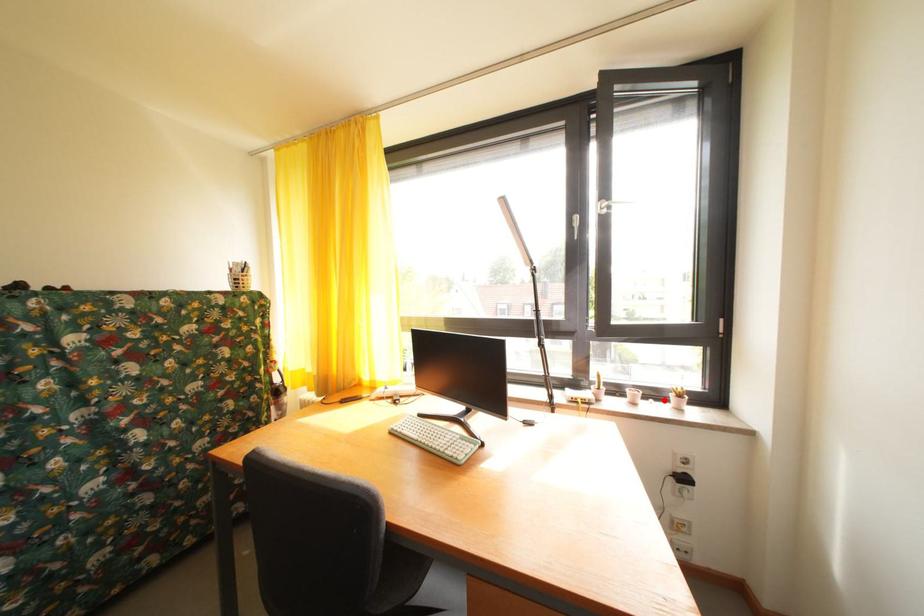
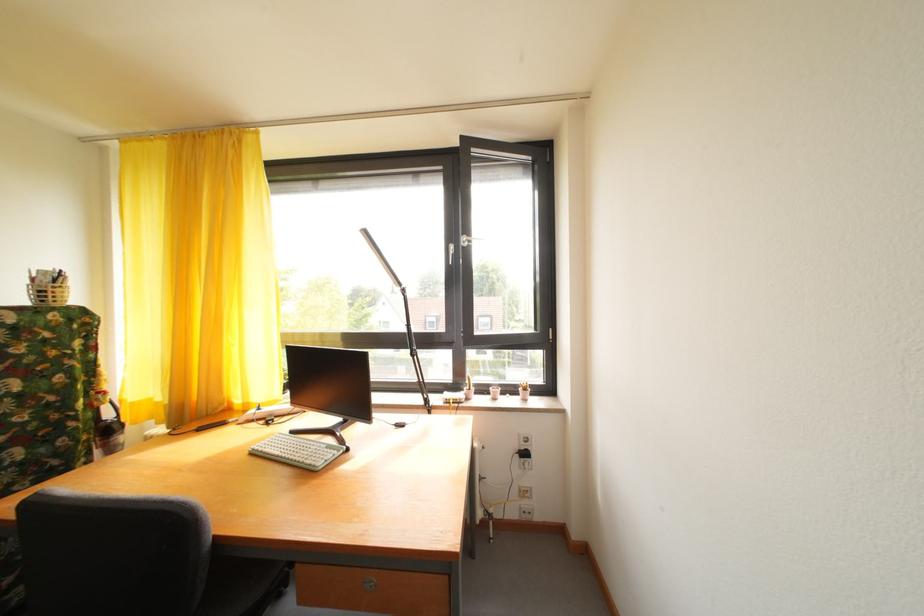
Locate, in the second image, the point that corresponds to the highlighted location in the first image.

(520, 395)